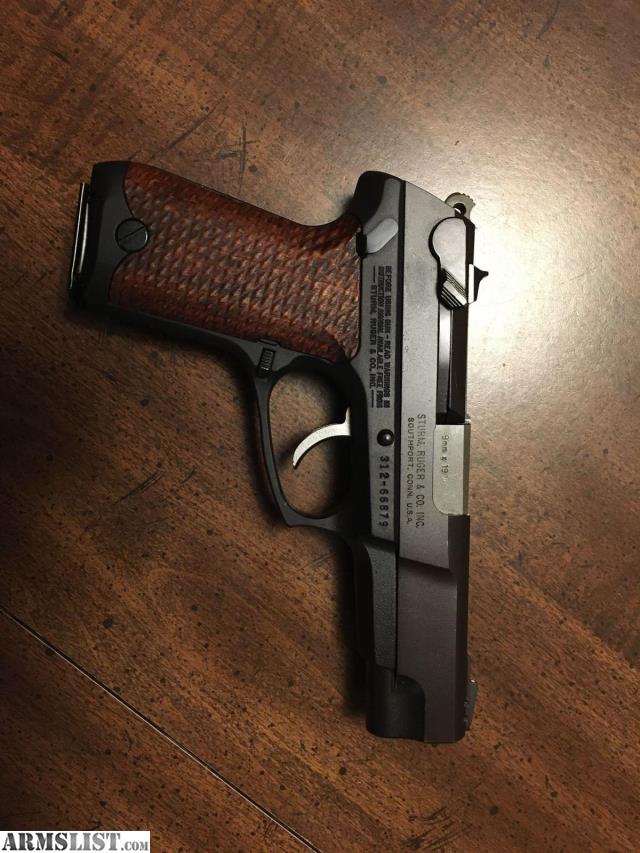
The image size is (640, 853). What are the coordinates of `reflection on table` in the screenshot? It's located at (499, 309).